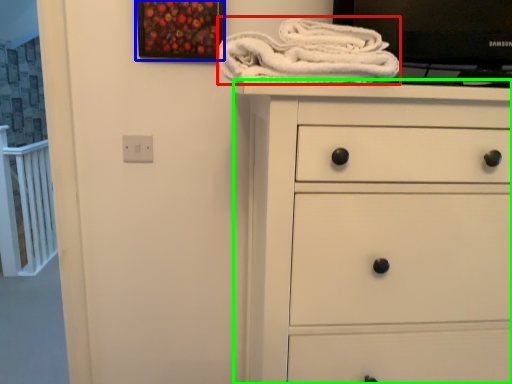
Question: Based on their relative distances, which object is nearer to bath towel (highlighted by a red box)? Choose from picture frame (highlighted by a blue box) and chest of drawers (highlighted by a green box).

Choices:
 (A) picture frame
 (B) chest of drawers

Answer: (B)